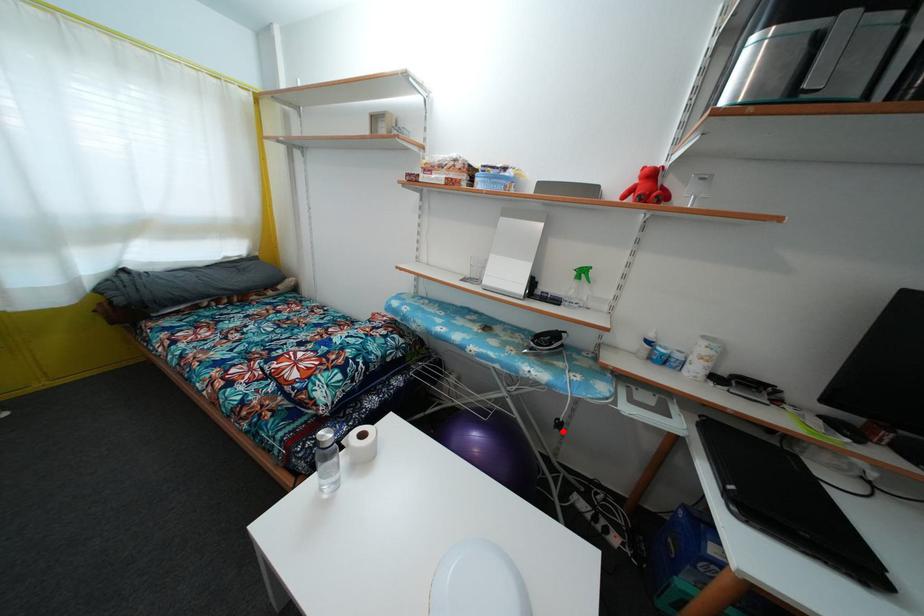
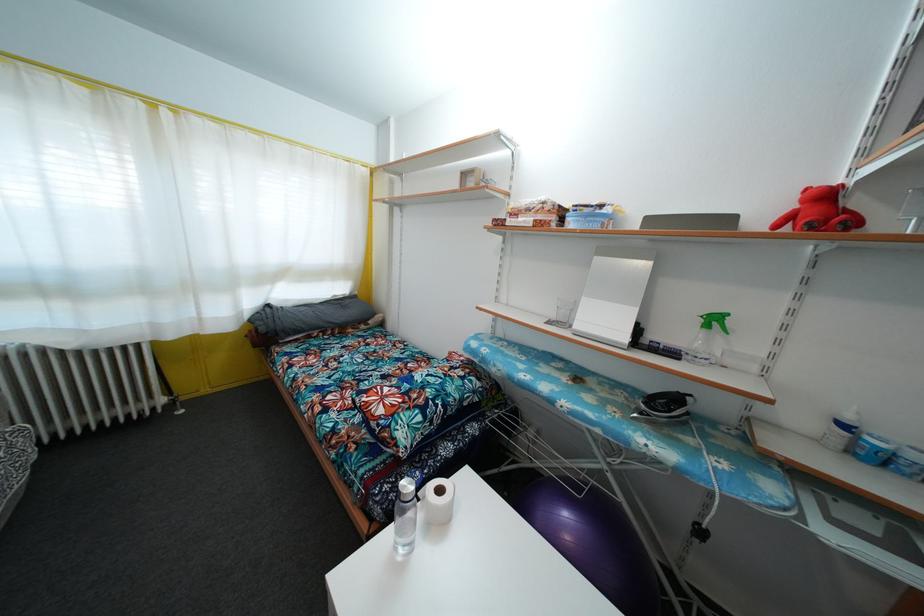
The point at the highlighted location is marked in the first image. Where is the corresponding point in the second image?

(704, 540)